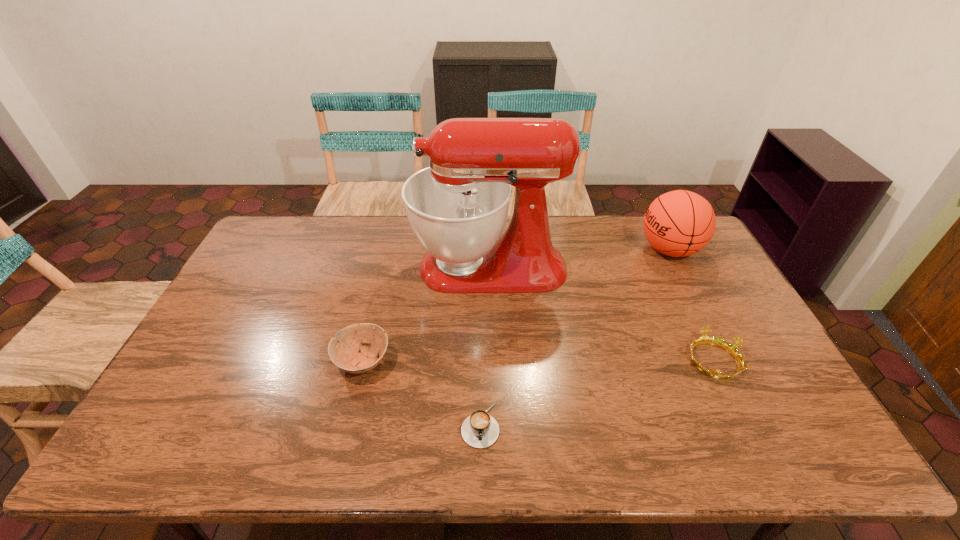
Where is `vacant space that satisfies the following two spatial constraints: 1. at the attachment hub of the tallest object; 2. on the back side of the crown`? vacant space that satisfies the following two spatial constraints: 1. at the attachment hub of the tallest object; 2. on the back side of the crown is located at coordinates (492, 360).

The image size is (960, 540). Find the location of `vacant area that satisfies the following two spatial constraints: 1. at the attachment hub of the tallest object; 2. with the handle on the side of the cappuccino`. vacant area that satisfies the following two spatial constraints: 1. at the attachment hub of the tallest object; 2. with the handle on the side of the cappuccino is located at coordinates (493, 424).

The width and height of the screenshot is (960, 540). Identify the location of blank area in the image that satisfies the following two spatial constraints: 1. on the back side of the crown; 2. on the right side of the third shortest object. (363, 360).

This screenshot has height=540, width=960. What are the coordinates of `vacant region that satisfies the following two spatial constraints: 1. on the back side of the bowl; 2. on the left side of the crown` in the screenshot? It's located at (363, 360).